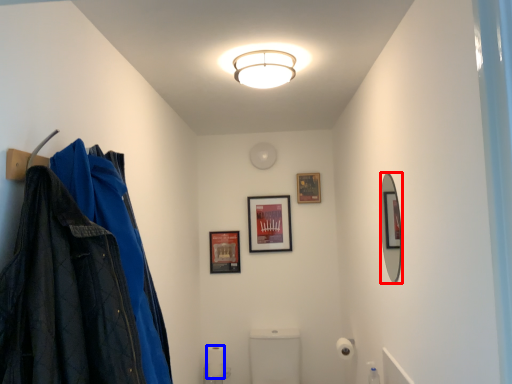
Question: Among these objects, which one is nearest to the camera, mirror (highlighted by a red box) or toilet paper (highlighted by a blue box)?

Choices:
 (A) mirror
 (B) toilet paper

Answer: (A)